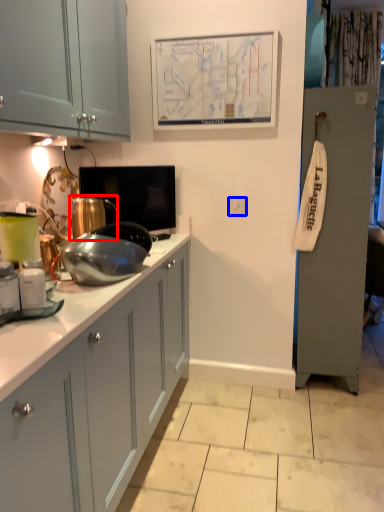
Question: Which object appears closest to the camera in this image, appliance (highlighted by a red box) or electric outlet (highlighted by a blue box)?

Choices:
 (A) appliance
 (B) electric outlet

Answer: (A)